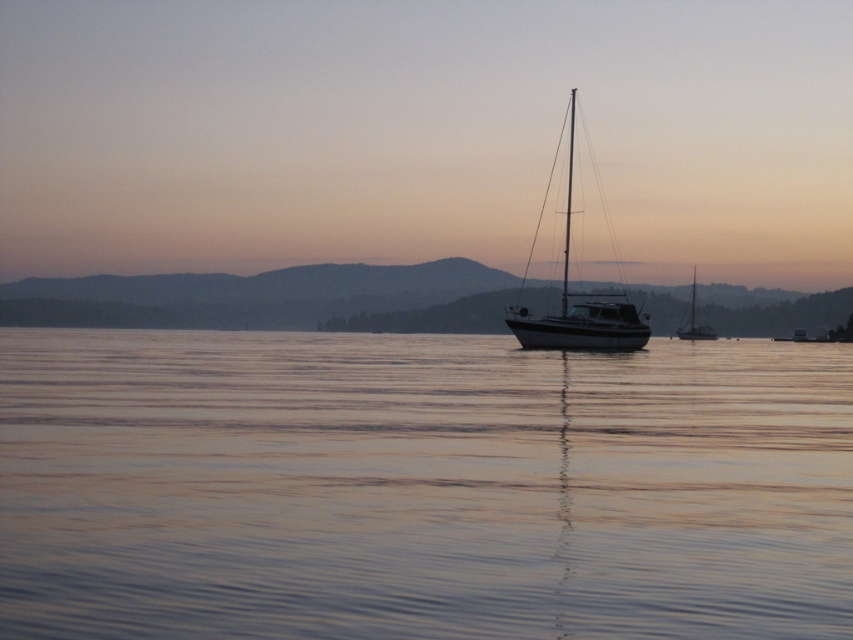
You are an observer standing on the dock and see the shiny white sailboat at center and the shiny silver sailboat at right. Which one is wider?

The shiny white sailboat at center is wider than the shiny silver sailboat at right.

You are standing on the dock and see the shiny white sailboat at center and the shiny silver sailboat at right. Which boat is closer to you?

The shiny white sailboat at center is closer to you because it is in front of the shiny silver sailboat at right.